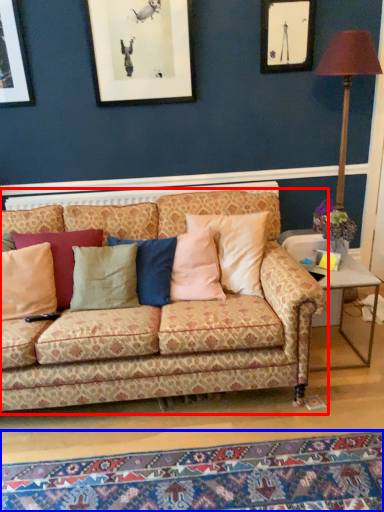
Question: Among these objects, which one is nearest to the camera, studio couch (highlighted by a red box) or mat (highlighted by a blue box)?

Choices:
 (A) studio couch
 (B) mat

Answer: (B)